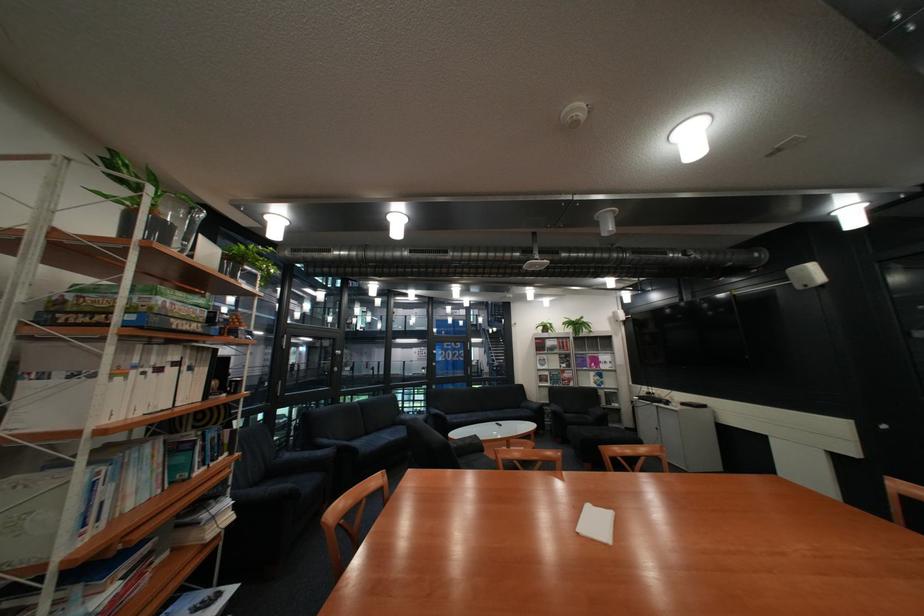
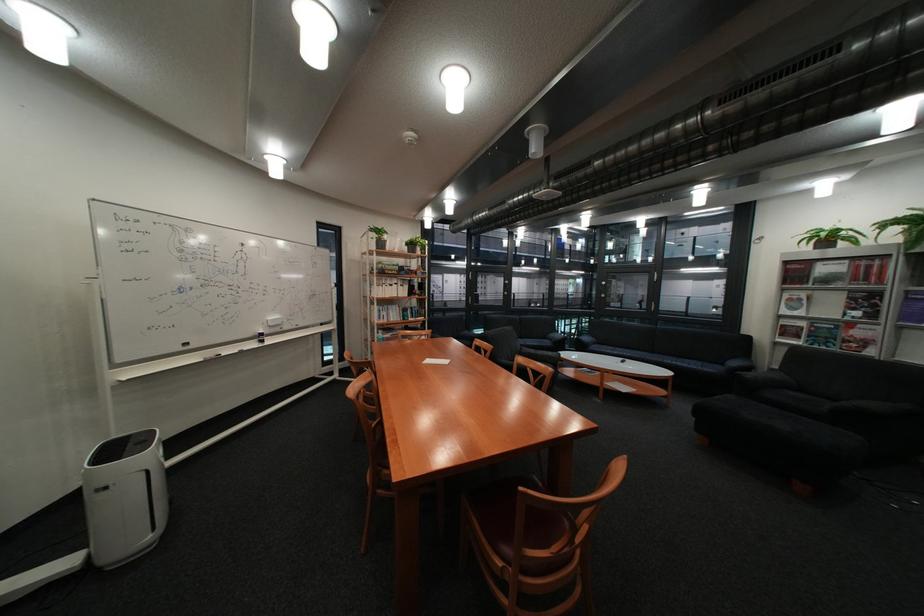
Locate, in the second image, the point that corresponds to point (535, 408) in the first image.

(737, 363)